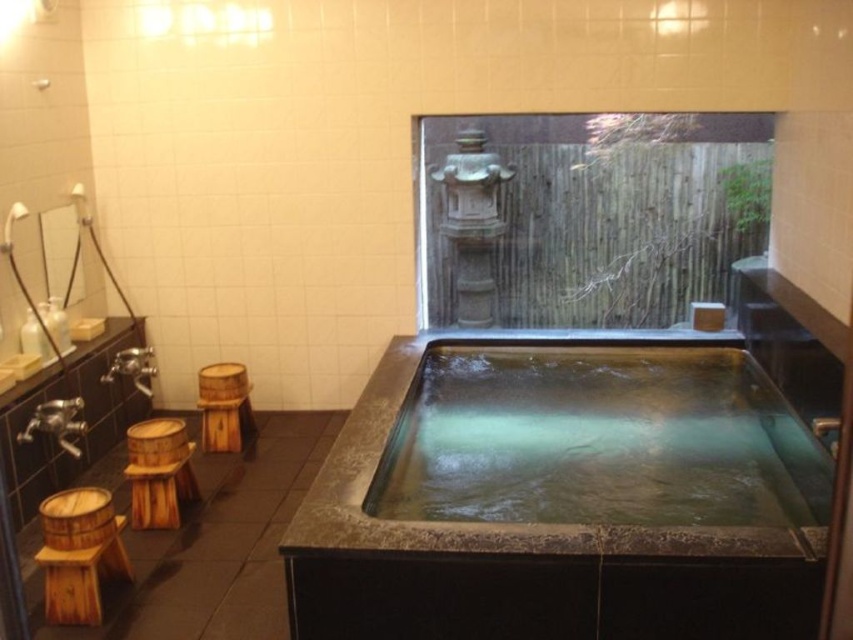
Question: Which point appears closest to the camera in this image?

Choices:
 (A) (80, 612)
 (B) (158, 470)
 (C) (241, 449)

Answer: (A)

Question: Which of the following is the farthest from the observer?

Choices:
 (A) (131, 438)
 (B) (199, 381)

Answer: (B)

Question: Can you confirm if smooth stone bath at center is positioned to the right of wooden barrel stool at lower left?

Choices:
 (A) no
 (B) yes

Answer: (B)

Question: Can you confirm if smooth stone bath at center is positioned below wooden barrel stool at lower left?

Choices:
 (A) no
 (B) yes

Answer: (A)

Question: Based on their relative distances, which object is farther from the wooden at left?

Choices:
 (A) wooden barrel stool at lower left
 (B) wooden stool at lower left

Answer: (A)

Question: Where is smooth stone bath at center located in relation to wooden barrel stool at lower left in the image?

Choices:
 (A) left
 (B) right

Answer: (B)